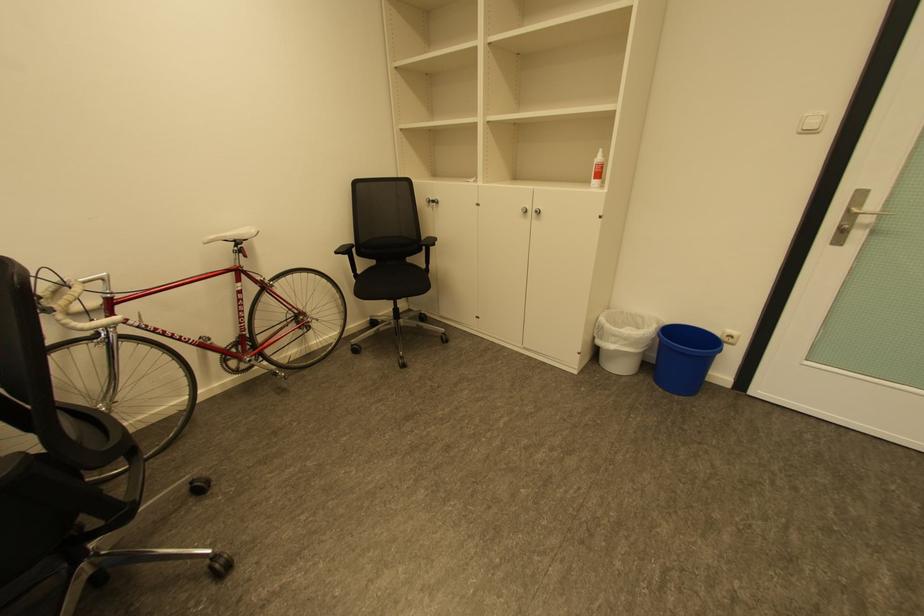
The width and height of the screenshot is (924, 616). Find the location of `white bicycle saddle`. white bicycle saddle is located at coordinates (x=234, y=235).